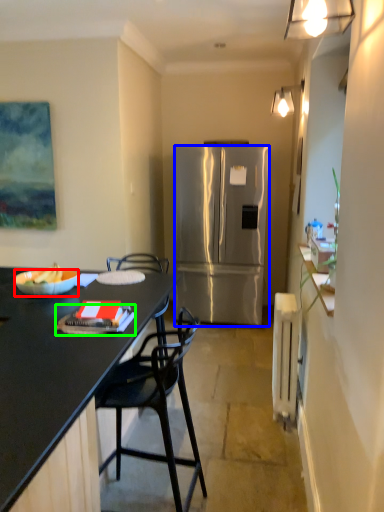
Question: Which object is the closest to the bowl (highlighted by a red box)? Choose among these: refrigerator (highlighted by a blue box) or book (highlighted by a green box).

Choices:
 (A) refrigerator
 (B) book

Answer: (B)